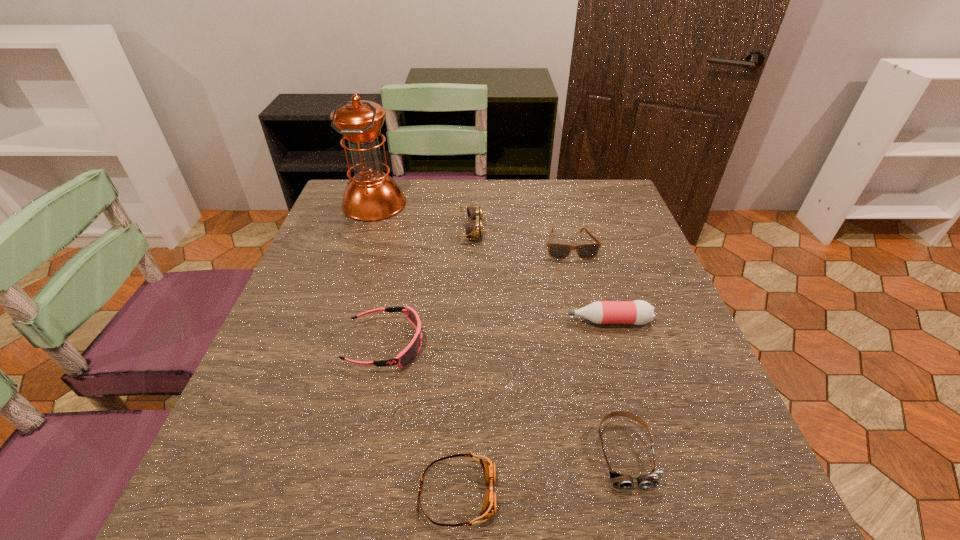
Locate an element on the screen. This screenshot has height=540, width=960. oil lamp is located at coordinates coord(371,195).

At what (x,y) coordinates should I click in order to perform the action: click on the farthest goggles. Please return your answer as a coordinate pair (x, y). Looking at the image, I should click on (474, 229).

Where is `bottle`? The height and width of the screenshot is (540, 960). bottle is located at coordinates (638, 312).

Locate an element on the screen. This screenshot has height=540, width=960. the second farthest goggles is located at coordinates (409, 353).

Locate an element on the screen. This screenshot has height=540, width=960. sunglasses is located at coordinates (556, 251).

Where is `the rightmost goggles`? the rightmost goggles is located at coordinates (623, 481).

Image resolution: width=960 pixels, height=540 pixels. Find the location of `vacant region located 0.340m on the front of the tallest object`. vacant region located 0.340m on the front of the tallest object is located at coordinates (338, 313).

What are the coordinates of `free space located through the lenses of the farthest goggles` in the screenshot? It's located at (555, 231).

Identify the location of vacant space located 0.330m with the cap open on the bottle. (409, 321).

At what (x,y) coordinates should I click in order to perform the action: click on vacant space located 0.250m with the cap open on the bottle. Please return your answer as a coordinate pair (x, y). Looking at the image, I should click on (447, 321).